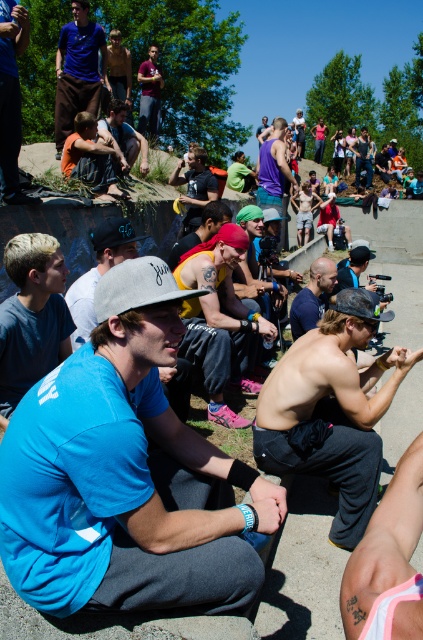
You are a photographer at the skateboarding event. You have a shiny metallic camera at center and a gray fabric baseball cap at center. Which object should you choose to carry in your small camera bag if you want to take both but have limited space?

The gray fabric baseball cap at center is smaller than the shiny metallic camera at center, so it can be stored in the small camera bag along with the camera.